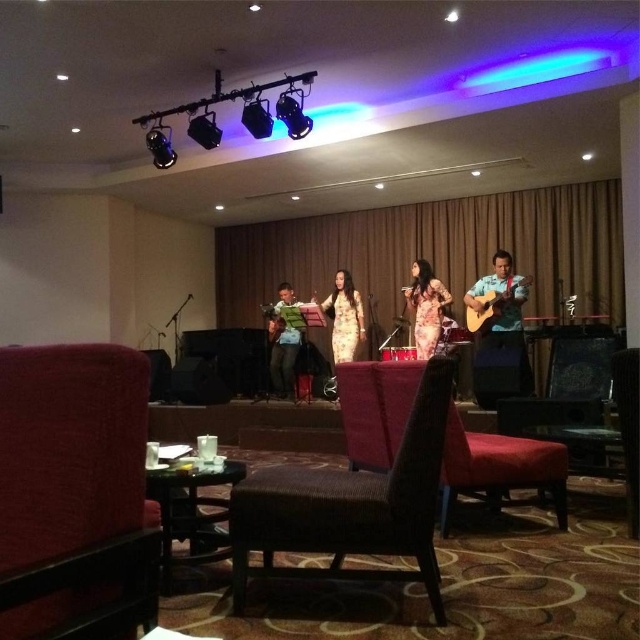
Between point (490, 300) and point (424, 276), which one is positioned behind?

The point (424, 276) is more distant.

Which is above, wooden acoustic guitar at right or patterned fabric dress at center?

patterned fabric dress at center is above.

Who is more forward, (522, 330) or (426, 324)?

Point (522, 330) is in front.

In order to click on wooden acoustic guitar at right in this screenshot , I will do `click(499, 333)`.

Can you confirm if velvet red armchair at lower left is taller than dark brown woven armchair at center?

Incorrect, velvet red armchair at lower left's height is not larger of dark brown woven armchair at center's.

Is velvet red armchair at lower left below dark brown woven armchair at center?

Incorrect, velvet red armchair at lower left is not positioned below dark brown woven armchair at center.

Locate an element on the screen. The height and width of the screenshot is (640, 640). velvet red armchair at lower left is located at coordinates (74, 493).

Measure the distance from dark brown woven armchair at center to green fabric shirt at center.

dark brown woven armchair at center and green fabric shirt at center are 15.22 feet apart.

Which of these two, dark brown woven armchair at center or green fabric shirt at center, stands taller?

green fabric shirt at center is taller.

I want to click on dark brown woven armchair at center, so click(349, 506).